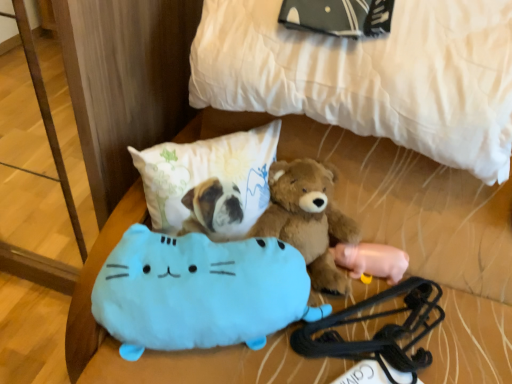
Question: Is black rubber luggage strap at lower right inside or outside of white quilted bed at upper center?

Choices:
 (A) inside
 (B) outside

Answer: (B)

Question: Looking at the image, does black rubber luggage strap at lower right seem bigger or smaller compared to white quilted bed at upper center?

Choices:
 (A) small
 (B) big

Answer: (A)

Question: Based on their relative distances, which object is nearer to the pink rubber pig at lower right, acting as the 1th toy starting from the right?

Choices:
 (A) fluffy white pillow at center
 (B) black rubber luggage strap at lower right
 (C) light blue plush cat at lower center, the 1th toy from the left
 (D) white quilted bed at upper center
 (E) brown plush teddy bear at center

Answer: (E)

Question: Which object is the farthest from the white quilted bed at upper center?

Choices:
 (A) pink rubber pig at lower right, acting as the 2th toy starting from the front
 (B) fluffy white pillow at center
 (C) brown plush teddy bear at center
 (D) black rubber luggage strap at lower right
 (E) light blue plush cat at lower center, marked as the second toy in a back-to-front arrangement

Answer: (D)